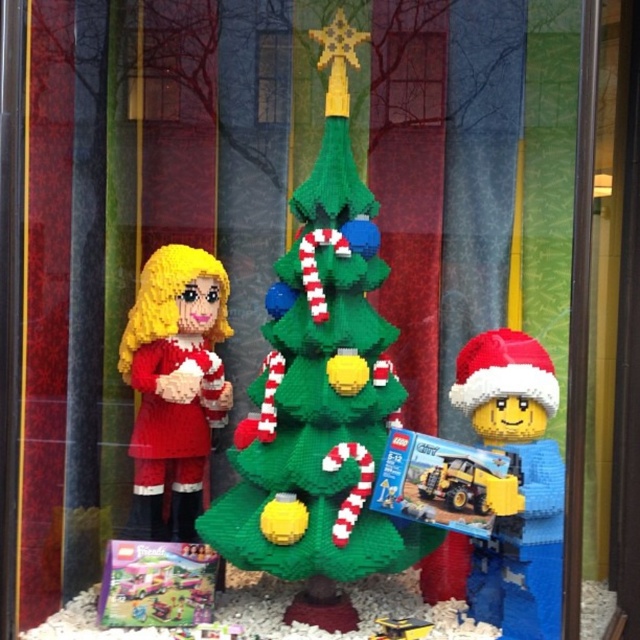
Question: Can you confirm if matte red fabric dress at left is thinner than translucent plastic toy at center?

Choices:
 (A) yes
 (B) no

Answer: (B)

Question: Does yellow matte lego man at right have a lesser width compared to transparent glass at center?

Choices:
 (A) yes
 (B) no

Answer: (B)

Question: Does transparent glass window at center have a smaller size compared to transparent glass at center?

Choices:
 (A) no
 (B) yes

Answer: (A)

Question: Which of these objects is positioned farthest from the yellow matte lego man at right?

Choices:
 (A) translucent plastic toy at center
 (B) green lego christmas tree at center
 (C) transparent glass at center
 (D) yellow plastic toy truck at center

Answer: (C)

Question: Which of the following is the closest to the observer?

Choices:
 (A) (502, 564)
 (B) (387, 86)

Answer: (A)

Question: Estimate the real-world distances between objects in this image. Which object is closer to the translucent plastic toy at center?

Choices:
 (A) yellow plastic toy truck at center
 (B) matte red fabric dress at left

Answer: (B)